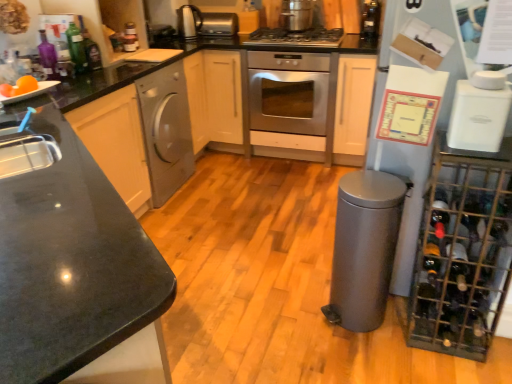
Image resolution: width=512 pixels, height=384 pixels. In order to click on free point above black granite countertop at left (from a real-world perspective) in this screenshot , I will do `click(67, 230)`.